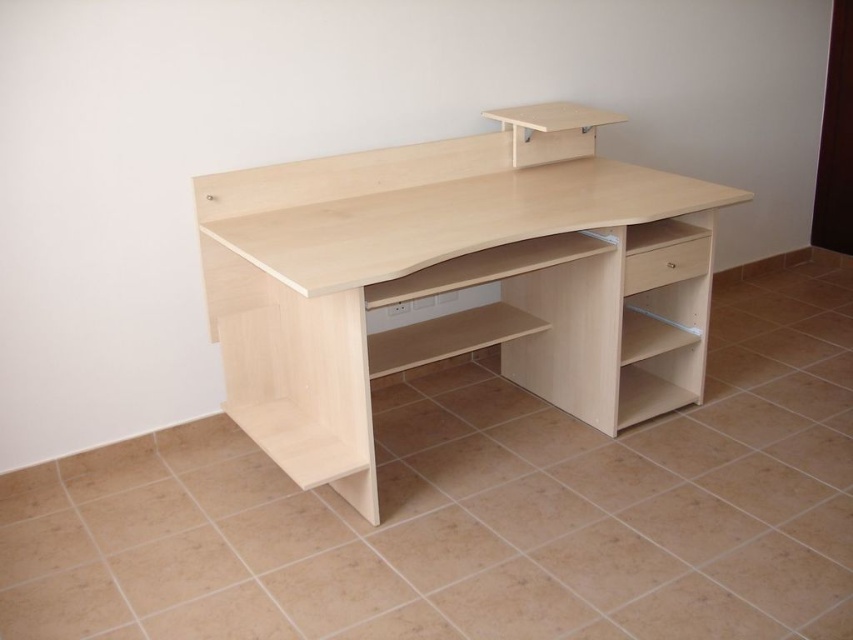
Question: Among these points, which one is farthest from the camera?

Choices:
 (A) (647, 257)
 (B) (434, 220)

Answer: (A)

Question: Which object is closer to the camera taking this photo?

Choices:
 (A) light wood computer desk at center
 (B) light wood drawer at right

Answer: (A)

Question: Which point is closer to the camera?

Choices:
 (A) light wood drawer at right
 (B) light wood computer desk at center

Answer: (B)

Question: Can you confirm if light wood computer desk at center is bigger than light wood drawer at right?

Choices:
 (A) no
 (B) yes

Answer: (B)

Question: Where is light wood computer desk at center located in relation to light wood drawer at right in the image?

Choices:
 (A) left
 (B) right

Answer: (A)

Question: Does light wood computer desk at center appear on the right side of light wood drawer at right?

Choices:
 (A) yes
 (B) no

Answer: (B)